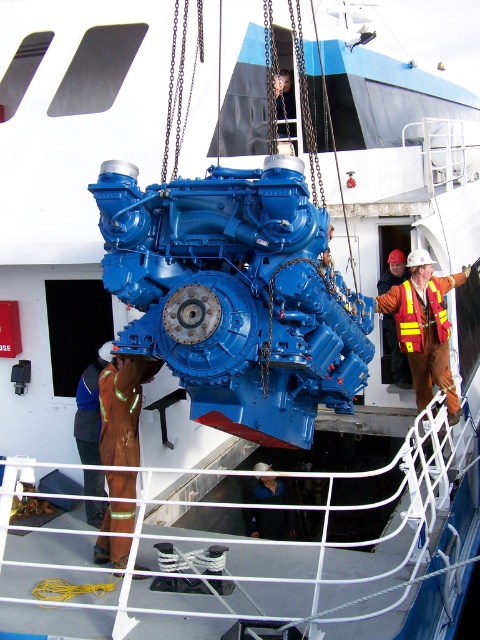
You are an engineer inspecting the ship deck. You notice two safety vests labeled reflective yellow safety vest at right and yellow reflective safety vest at right. Which one is bigger?

The reflective yellow safety vest at right is larger in size than the yellow reflective safety vest at right.

You are standing on the ship deck and need to locate the brown reflective safety suit at lower left. According to the coordinates provided, where exactly is it positioned?

The brown reflective safety suit at lower left is located at point coordinates (x=122, y=408).

You are standing on the ship deck and see the point marked at coordinate (424, 326). What object is located at that coordinate?

The point at coordinate (424, 326) indicates a reflective yellow safety vest at right.